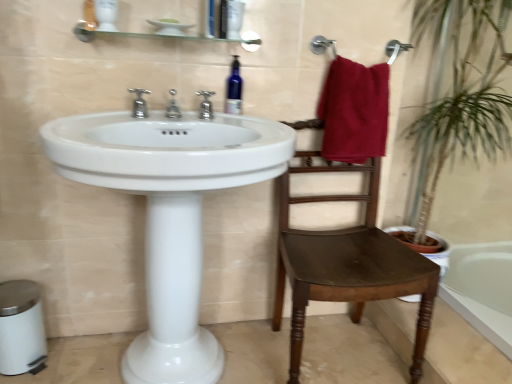
Find the location of a particular element. vacant area that lies in front of polished chrome faucet at center, the 1th tap in the left-to-right sequence is located at coordinates (94, 125).